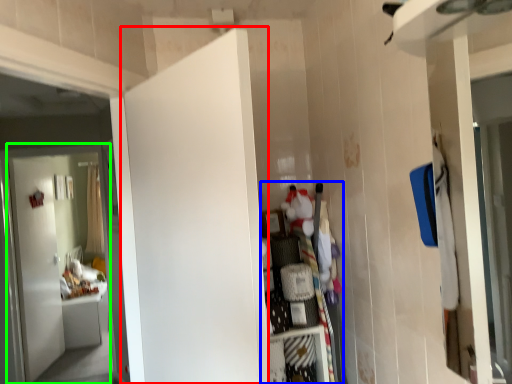
Question: Estimate the real-world distances between objects in this image. Which object is farther from door (highlighted by a red box), dresser (highlighted by a blue box) or door (highlighted by a green box)?

Choices:
 (A) dresser
 (B) door

Answer: (B)